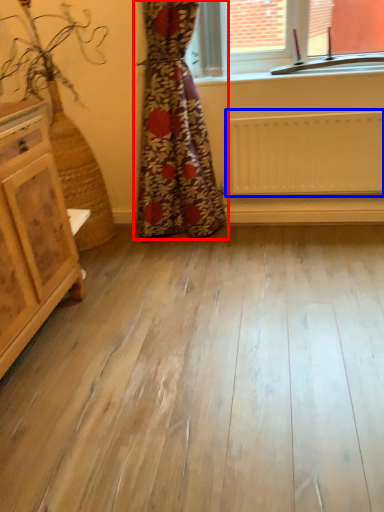
Question: Which object appears farthest to the camera in this image, curtain (highlighted by a red box) or radiator (highlighted by a blue box)?

Choices:
 (A) curtain
 (B) radiator

Answer: (B)